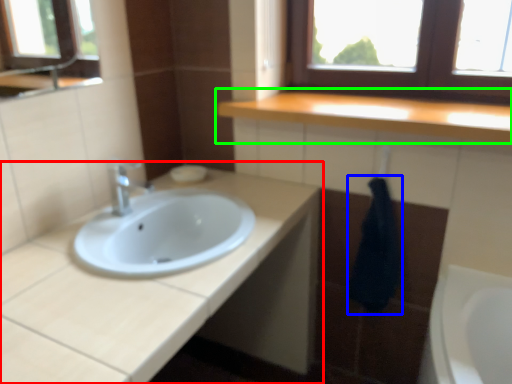
Question: Considering the real-world distances, which object is farthest from bathroom cabinet (highlighted by a red box)? bath towel (highlighted by a blue box) or countertop (highlighted by a green box)?

Choices:
 (A) bath towel
 (B) countertop

Answer: (B)